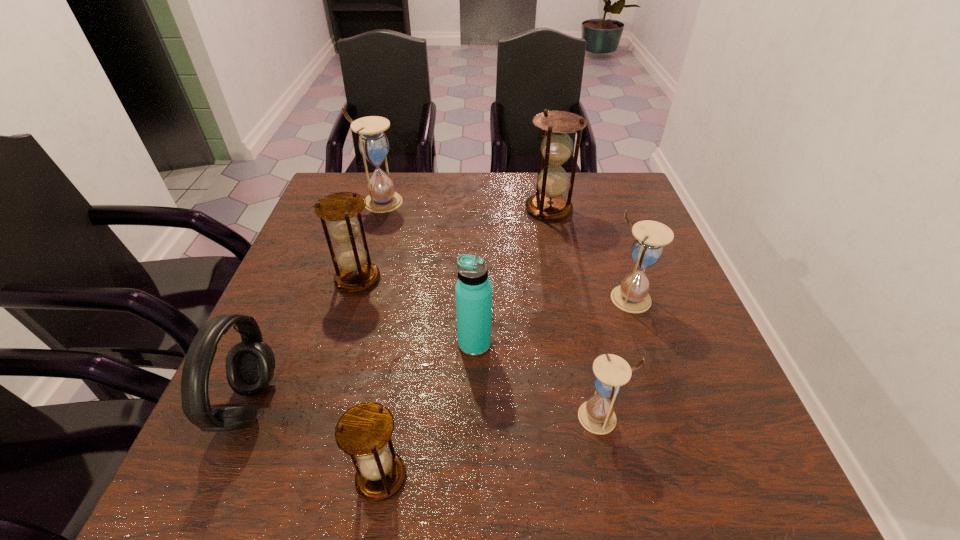
Where is `free space between the rightmost object and the headset`? The image size is (960, 540). free space between the rightmost object and the headset is located at coordinates click(440, 352).

Identify the location of vacant area that lies between the fifth object from right to left and the second white hourglass from left to right. (492, 447).

Locate an element on the screen. This screenshot has width=960, height=540. free space between the fifth farthest hourglass and the rightmost brown hourglass is located at coordinates (575, 313).

I want to click on empty space between the fifth farthest object and the second biggest brown hourglass, so click(416, 312).

Locate an element on the screen. vacant point located between the leftmost white hourglass and the second farthest brown hourglass is located at coordinates (369, 240).

Choose which object is the second nearest neighbor to the nearest brown hourglass. Please provide its 2D coordinates. Your answer should be formatted as a tuple, i.e. [(x, y)], where the tuple contains the x and y coordinates of a point satisfying the conditions above.

[(473, 290)]

In order to click on the fourth closest object to the smallest white hourglass in this screenshot , I will do `click(357, 273)`.

Point out which hourglass is positioned as the fifth nearest to the second nearest hourglass. Please provide its 2D coordinates. Your answer should be formatted as a tuple, i.e. [(x, y)], where the tuple contains the x and y coordinates of a point satisfying the conditions above.

[(373, 144)]

At what (x,y) coordinates should I click in order to perform the action: click on the closest hourglass to the leftmost white hourglass. Please return your answer as a coordinate pair (x, y). Image resolution: width=960 pixels, height=540 pixels. Looking at the image, I should click on point(357,273).

Where is `the second closest white hourglass relative to the leftmost object`? The image size is (960, 540). the second closest white hourglass relative to the leftmost object is located at coordinates (597, 415).